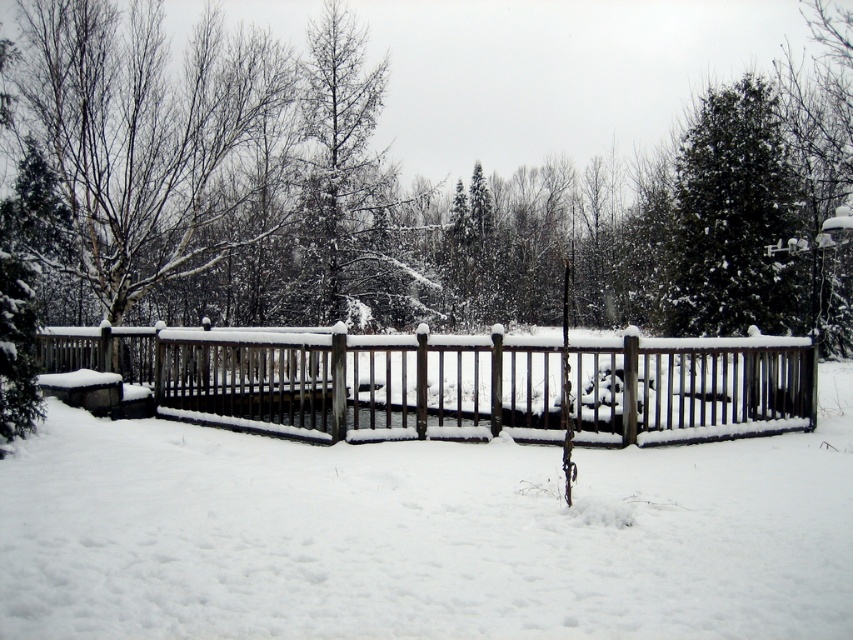
You are standing in the winter scene and want to place a small snowman exactly halfway between point (189, 420) and point (718, 180). Will the snowman be closer to the wooden fence or the body of water?

The snowman will be closer to the wooden fence because point (189, 420) is closer to the viewer than point (718, 180), and the wooden fence is in the foreground of the image.

You are standing at the point labeled as point (405, 536) in the image. What object are you facing directly?

The point (405, 536) indicates white wooden fence at center, so you are facing the white wooden fence at center directly.

You are standing in the winter scene and want to walk from the wooden fence to the body of water. You notice two points marked on the ground. Which point, point (833, 609) or point (653, 412), is closer to you as you stand at the fence?

Point (833, 609) is closer to the viewer than point (653, 412), so it is the closer point to you as you stand at the fence.